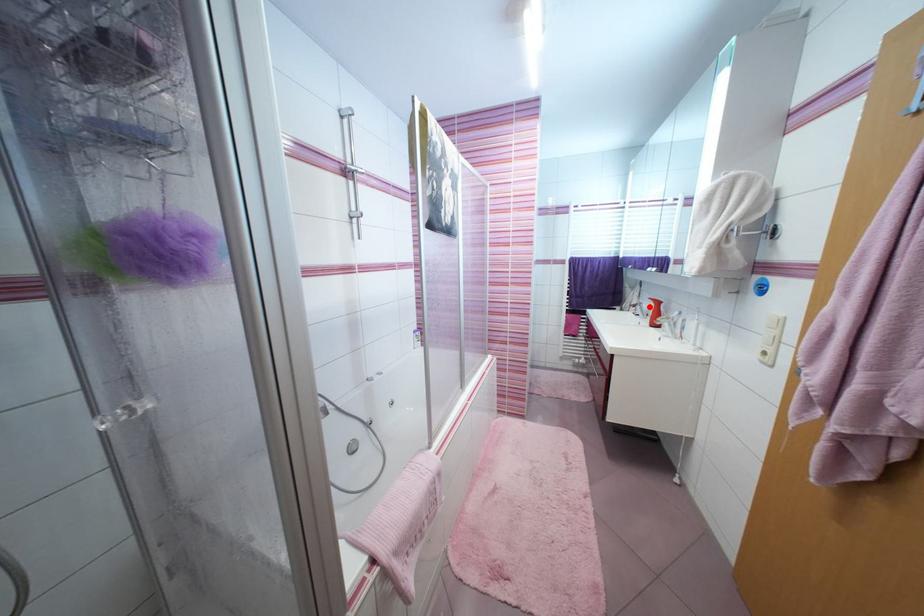
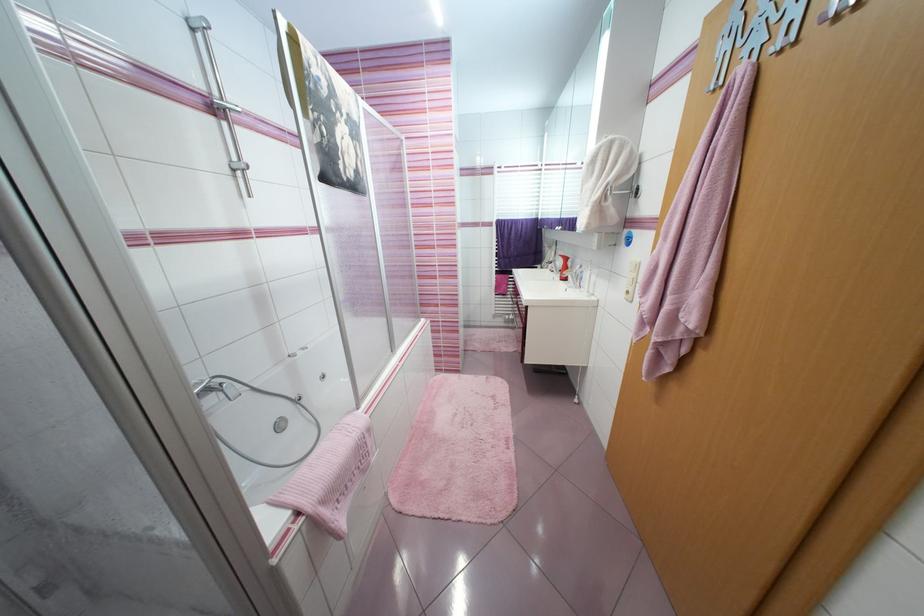
Locate, in the second image, the point that corresponds to the highlighted location in the first image.

(563, 264)